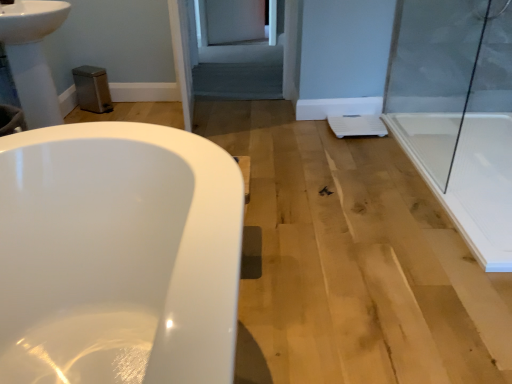
Question: Is gray fabric screen door at center smaller than transparent glass shower door at right?

Choices:
 (A) no
 (B) yes

Answer: (A)

Question: Is gray fabric screen door at center taller than transparent glass shower door at right?

Choices:
 (A) no
 (B) yes

Answer: (A)

Question: Is gray fabric screen door at center bigger than transparent glass shower door at right?

Choices:
 (A) no
 (B) yes

Answer: (B)

Question: Is gray fabric screen door at center outside transparent glass shower door at right?

Choices:
 (A) yes
 (B) no

Answer: (A)

Question: Is gray fabric screen door at center to the right of transparent glass shower door at right from the viewer's perspective?

Choices:
 (A) yes
 (B) no

Answer: (B)

Question: Considering the positions of point (438, 26) and point (0, 6), is point (438, 26) closer or farther from the camera than point (0, 6)?

Choices:
 (A) closer
 (B) farther

Answer: (B)

Question: Is transparent glass shower door at right wider or thinner than silver metallic faucet at upper left?

Choices:
 (A) thin
 (B) wide

Answer: (A)

Question: From their relative heights in the image, would you say transparent glass shower door at right is taller or shorter than silver metallic faucet at upper left?

Choices:
 (A) short
 (B) tall

Answer: (B)

Question: From the image's perspective, is transparent glass shower door at right located above or below silver metallic faucet at upper left?

Choices:
 (A) above
 (B) below

Answer: (B)

Question: Would you say silver metallic faucet at upper left is inside or outside transparent glass shower door at right?

Choices:
 (A) outside
 (B) inside

Answer: (A)

Question: From the image's perspective, is silver metallic faucet at upper left above or below transparent glass shower door at right?

Choices:
 (A) below
 (B) above

Answer: (B)

Question: Is silver metallic faucet at upper left bigger or smaller than transparent glass shower door at right?

Choices:
 (A) small
 (B) big

Answer: (A)

Question: Does point (13, 11) appear closer or farther from the camera than point (411, 11)?

Choices:
 (A) farther
 (B) closer

Answer: (B)

Question: In terms of height, does gray fabric screen door at center look taller or shorter compared to white glossy sink at upper left?

Choices:
 (A) tall
 (B) short

Answer: (B)

Question: From a real-world perspective, relative to white glossy sink at upper left, is gray fabric screen door at center vertically above or below?

Choices:
 (A) above
 (B) below

Answer: (B)